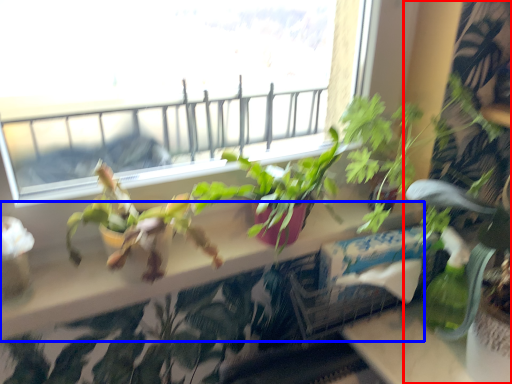
Question: Which object is further to the camera taking this photo, houseplant (highlighted by a red box) or window sill (highlighted by a blue box)?

Choices:
 (A) houseplant
 (B) window sill

Answer: (B)